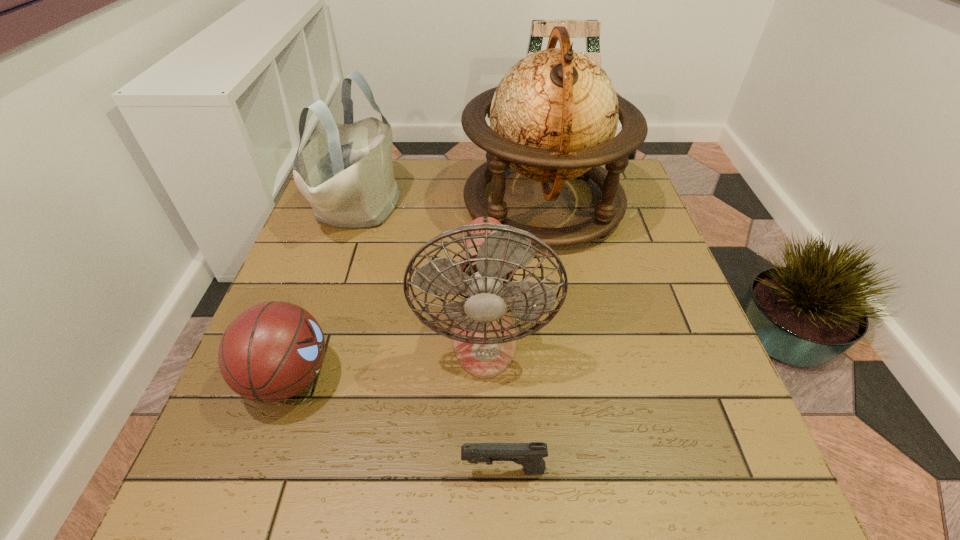
This screenshot has height=540, width=960. Find the location of `vacant region between the second shortest object and the tallest object`. vacant region between the second shortest object and the tallest object is located at coordinates (416, 291).

Find the location of a particular element. free space between the pistol and the basketball is located at coordinates (396, 424).

Locate an element on the screen. This screenshot has width=960, height=540. vacant space in between the shortest object and the fan is located at coordinates (493, 405).

What are the coordinates of `free spot between the fourth tallest object and the fan` in the screenshot? It's located at (386, 359).

I want to click on object that ranks as the fourth closest to the tallest object, so click(x=530, y=455).

Identify which object is located as the nearest to the shopping bag. Please provide its 2D coordinates. Your answer should be formatted as a tuple, i.e. [(x, y)], where the tuple contains the x and y coordinates of a point satisfying the conditions above.

[(553, 117)]

Identify the location of free space in the image that satisfies the following two spatial constraints: 1. on the back side of the basketball; 2. on the left side of the shopping bag. The image size is (960, 540). (348, 206).